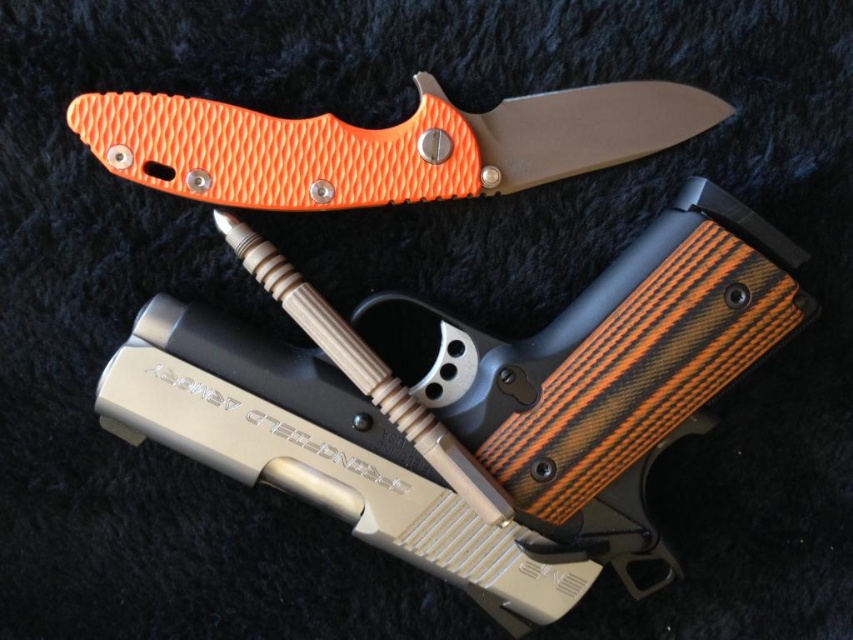
Question: Can you confirm if wooden-textured handgun at center is positioned above orange textured handle at upper center?

Choices:
 (A) yes
 (B) no

Answer: (B)

Question: Can you confirm if wooden-textured handgun at center is wider than orange textured handle at upper center?

Choices:
 (A) yes
 (B) no

Answer: (A)

Question: Among these points, which one is farthest from the camera?

Choices:
 (A) (x=235, y=134)
 (B) (x=752, y=333)

Answer: (A)

Question: Does wooden-textured handgun at center have a larger size compared to orange textured handle at upper center?

Choices:
 (A) no
 (B) yes

Answer: (B)